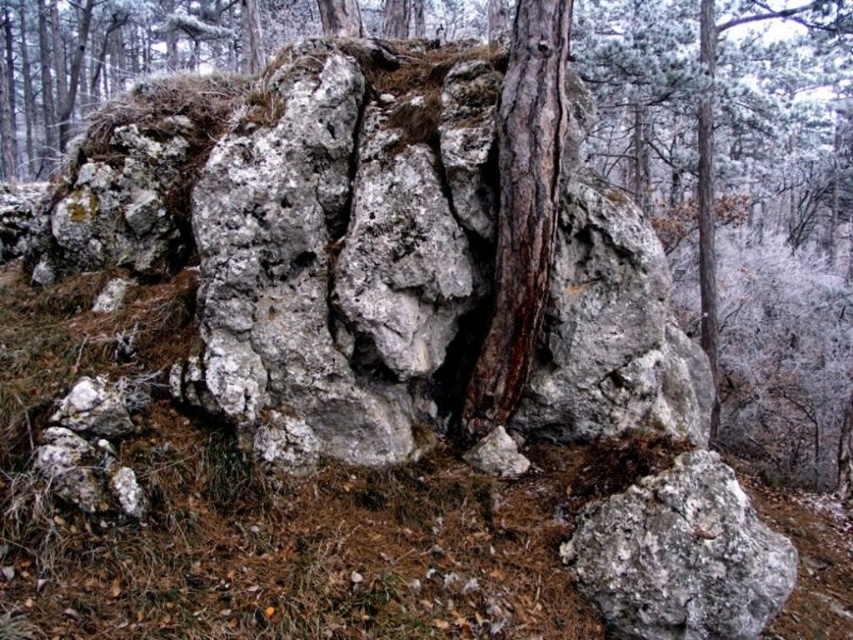
You are an explorer trying to cross a rocky terrain. You see a gray rough rock at center and a brown rough tree trunk at center. Which one has a wider base to step on?

The gray rough rock at center has a wider base to step on since its width is larger than the brown rough tree trunk at center.

You are standing at the point marked as point [346,248] in the image. What object is located exactly at that point?

The white lichen covered rock at center is located exactly at point [346,248].